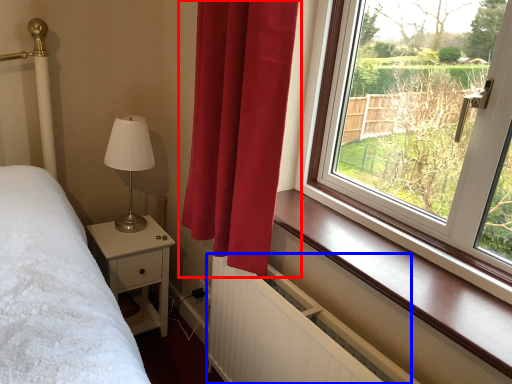
Question: Which of the following is the farthest to the observer, curtain (highlighted by a red box) or radiator (highlighted by a blue box)?

Choices:
 (A) curtain
 (B) radiator

Answer: (A)